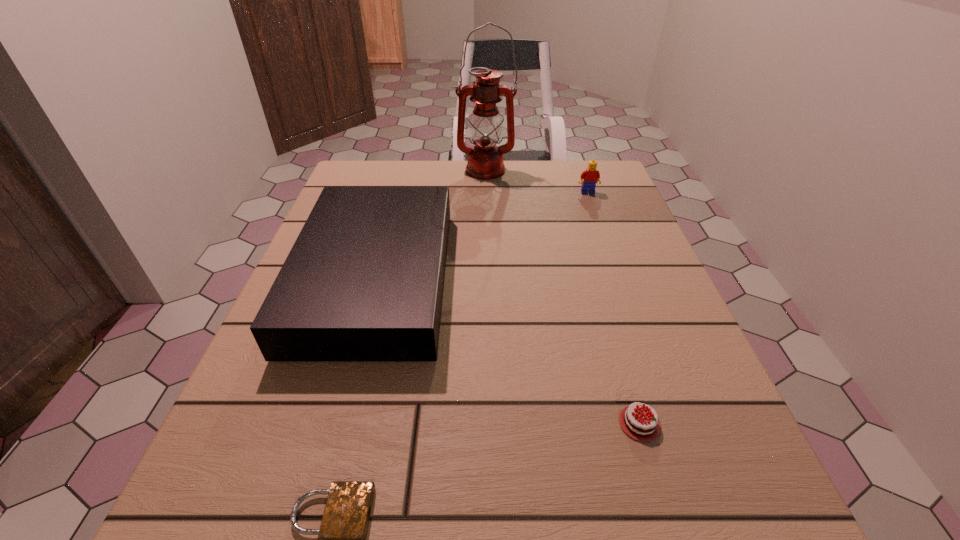
Locate an element on the screen. This screenshot has height=540, width=960. the tallest object is located at coordinates (485, 161).

The image size is (960, 540). Find the location of `the third object from left to right`. the third object from left to right is located at coordinates (485, 161).

Locate an element on the screen. Lego is located at coordinates (591, 176).

Find the location of a particular element. The height and width of the screenshot is (540, 960). CD player is located at coordinates (364, 280).

At what (x,y) coordinates should I click in order to perform the action: click on the second shortest object. Please return your answer as a coordinate pair (x, y). Looking at the image, I should click on (637, 425).

At what (x,y) coordinates should I click in order to perform the action: click on chocolate cake. Please return your answer as a coordinate pair (x, y). The height and width of the screenshot is (540, 960). Looking at the image, I should click on (637, 425).

The height and width of the screenshot is (540, 960). Find the location of `free space located on the front of the tallest object`. free space located on the front of the tallest object is located at coordinates (486, 271).

Where is `free region located on the face of the second farthest object`? This screenshot has height=540, width=960. free region located on the face of the second farthest object is located at coordinates (595, 214).

Where is `free space located 0.290m at the front of the third farthest object for disc insertion`? Image resolution: width=960 pixels, height=540 pixels. free space located 0.290m at the front of the third farthest object for disc insertion is located at coordinates (589, 279).

This screenshot has height=540, width=960. Identify the location of vacant area located on the back of the chocolate cake. (587, 247).